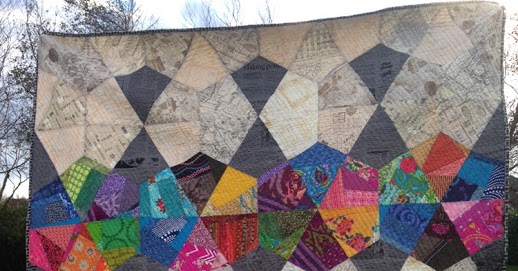
You are a GUI agent. You are given a task and a screenshot of the screen. Output one action in this format:
    pyautogui.click(x=<x>, y=<y>)
    Task: Click on the fabric
    The width and height of the screenshot is (518, 271).
    Given the screenshot: What is the action you would take?
    pyautogui.click(x=282, y=163)